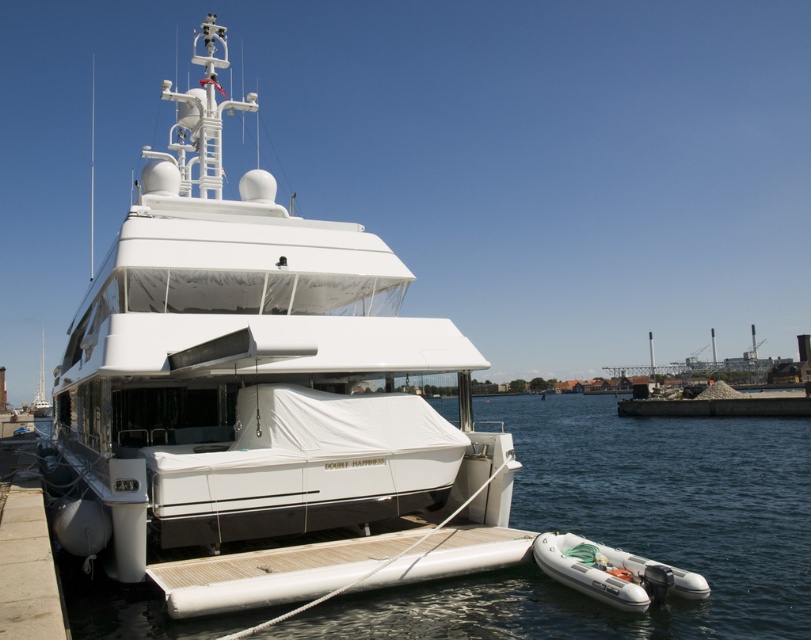
Question: Which point is farther from the camera taking this photo?

Choices:
 (A) (114, 588)
 (B) (255, 196)

Answer: (B)

Question: Which point is farther from the camera taking this photo?

Choices:
 (A) (179, 460)
 (B) (642, 564)
 (C) (604, 429)

Answer: (C)

Question: Can you confirm if white glossy yacht at center is positioned above white rubber dinghy at lower center?

Choices:
 (A) yes
 (B) no

Answer: (A)

Question: Is white glossy yacht at center smaller than white rubber dinghy at lower center?

Choices:
 (A) yes
 (B) no

Answer: (A)

Question: Estimate the real-world distances between objects in this image. Which object is farther from the white rubber dinghy at lower center?

Choices:
 (A) white rubber dinghy at lower right
 (B) white glossy yacht at center

Answer: (B)

Question: Observing the image, what is the correct spatial positioning of white glossy yacht at center in reference to white rubber dinghy at lower center?

Choices:
 (A) right
 (B) left

Answer: (B)